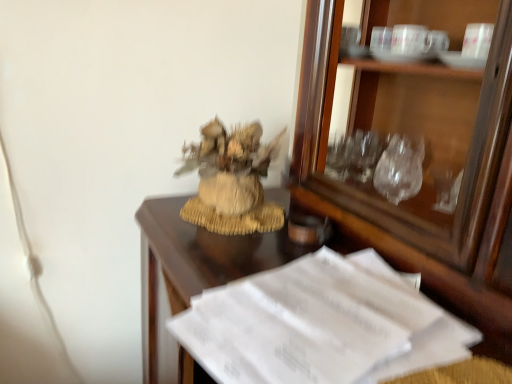
Question: Is burlap textured houseplant at center positioned in front of white paper at lower right?

Choices:
 (A) no
 (B) yes

Answer: (A)

Question: From the image's perspective, would you say burlap textured houseplant at center is shown under white paper at lower right?

Choices:
 (A) no
 (B) yes

Answer: (A)

Question: From a real-world perspective, is burlap textured houseplant at center beneath white paper at lower right?

Choices:
 (A) yes
 (B) no

Answer: (B)

Question: From the image's perspective, does burlap textured houseplant at center appear higher than white paper at lower right?

Choices:
 (A) no
 (B) yes

Answer: (B)

Question: Considering the relative sizes of burlap textured houseplant at center and white paper at lower right in the image provided, is burlap textured houseplant at center smaller than white paper at lower right?

Choices:
 (A) no
 (B) yes

Answer: (A)

Question: Looking at the image, does matte brown glass at center seem bigger or smaller compared to white paper at lower right?

Choices:
 (A) small
 (B) big

Answer: (A)

Question: From the image's perspective, is matte brown glass at center located above or below white paper at lower right?

Choices:
 (A) below
 (B) above

Answer: (B)

Question: Looking at their shapes, would you say matte brown glass at center is wider or thinner than white paper at lower right?

Choices:
 (A) wide
 (B) thin

Answer: (B)

Question: Considering the positions of matte brown glass at center and white paper at lower right in the image, is matte brown glass at center taller or shorter than white paper at lower right?

Choices:
 (A) short
 (B) tall

Answer: (A)

Question: Considering the positions of matte brown glass at center and burlap textured houseplant at center in the image, is matte brown glass at center wider or thinner than burlap textured houseplant at center?

Choices:
 (A) wide
 (B) thin

Answer: (B)

Question: Is matte brown glass at center to the left or to the right of burlap textured houseplant at center in the image?

Choices:
 (A) right
 (B) left

Answer: (A)

Question: From the image's perspective, relative to burlap textured houseplant at center, is matte brown glass at center above or below?

Choices:
 (A) below
 (B) above

Answer: (A)

Question: Is point (327, 223) positioned closer to the camera than point (196, 198)?

Choices:
 (A) farther
 (B) closer

Answer: (B)

Question: Which is correct: white paper at lower right is inside burlap textured houseplant at center, or outside of it?

Choices:
 (A) inside
 (B) outside

Answer: (B)

Question: In the image, is white paper at lower right positioned in front of or behind burlap textured houseplant at center?

Choices:
 (A) behind
 (B) front

Answer: (B)